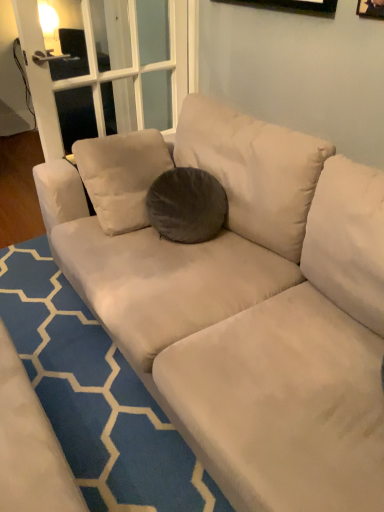
You are a GUI agent. You are given a task and a screenshot of the screen. Output one action in this format:
    pyautogui.click(x=<x>, y=<y>)
    Task: Click on the free space below blue textured rug at center (from a real-world perspective)
    Image resolution: width=384 pixels, height=512 pixels.
    Given the screenshot: What is the action you would take?
    pyautogui.click(x=75, y=356)